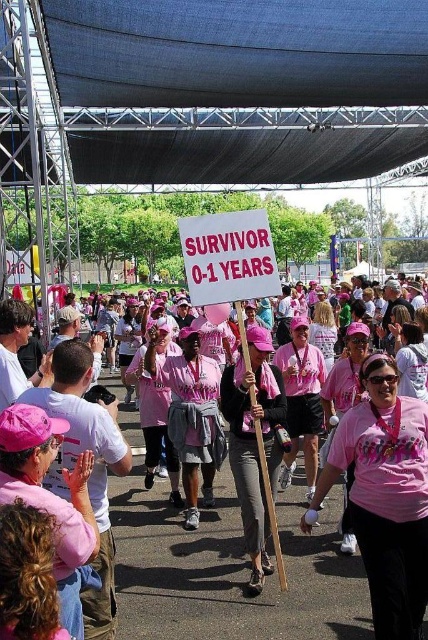
Does pink fabric sign at center appear under pink fabric shirt at center?

Indeed, pink fabric sign at center is positioned under pink fabric shirt at center.

Consider the image. Is pink fabric sign at center shorter than pink fabric shirt at center?

No, pink fabric sign at center is not shorter than pink fabric shirt at center.

Where is `pink fabric sign at center`? The image size is (428, 640). pink fabric sign at center is located at coordinates (226, 564).

Who is higher up, pink fabric sign at center or pink matte shirt at center?

pink matte shirt at center

What do you see at coordinates (226, 564) in the screenshot? I see `pink fabric sign at center` at bounding box center [226, 564].

Identify the location of pink fabric sign at center. This screenshot has height=640, width=428. (226, 564).

Is pink matte shirt at center to the left of pink fabric shirt at center from the viewer's perspective?

Correct, you'll find pink matte shirt at center to the left of pink fabric shirt at center.

Which is more to the left, pink matte shirt at center or pink fabric shirt at center?

Positioned to the left is pink matte shirt at center.

Does point (372, 595) come in front of point (332, 332)?

That is True.

This screenshot has width=428, height=640. In order to click on pink matte shirt at center in this screenshot , I will do `click(386, 497)`.